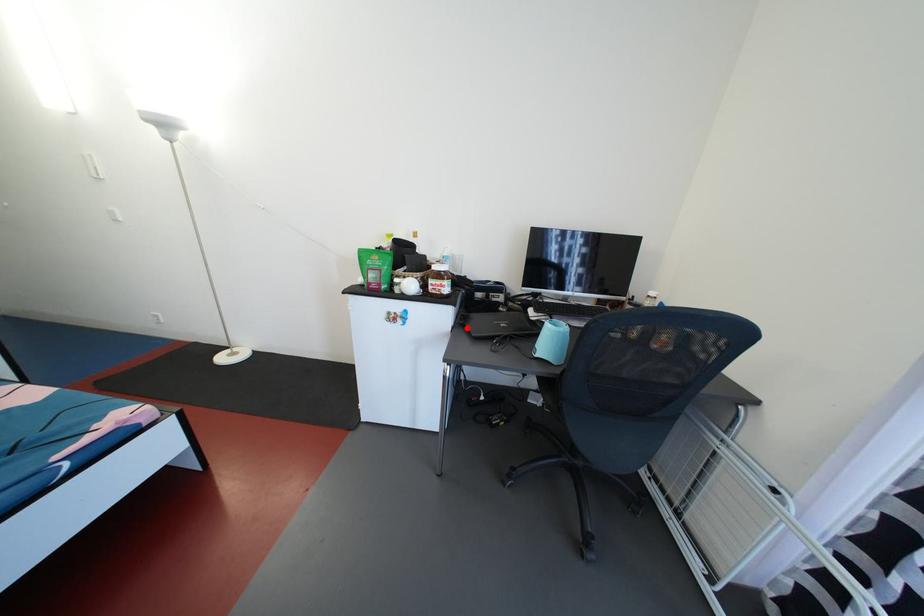
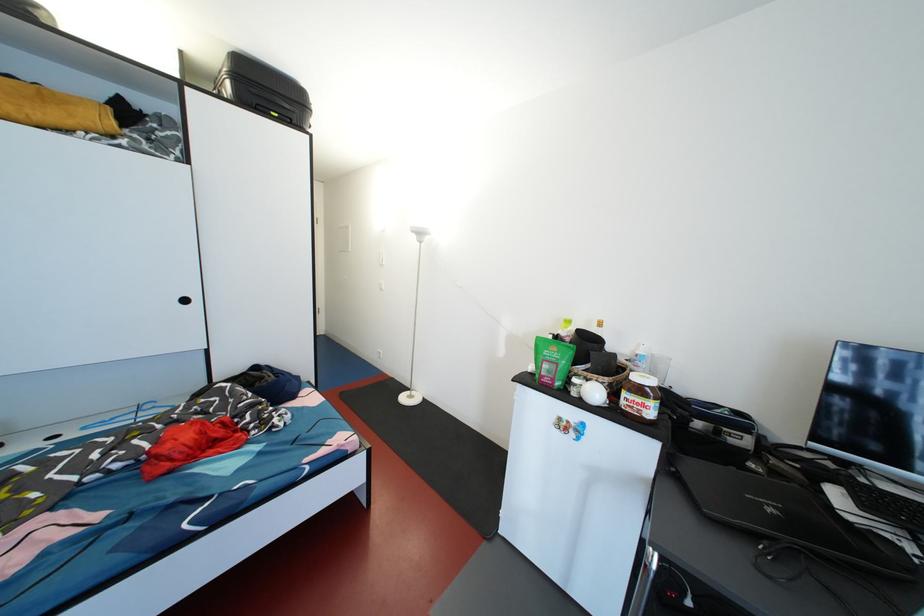
The point at the highlighted location is marked in the first image. Where is the corresponding point in the second image?

(675, 474)